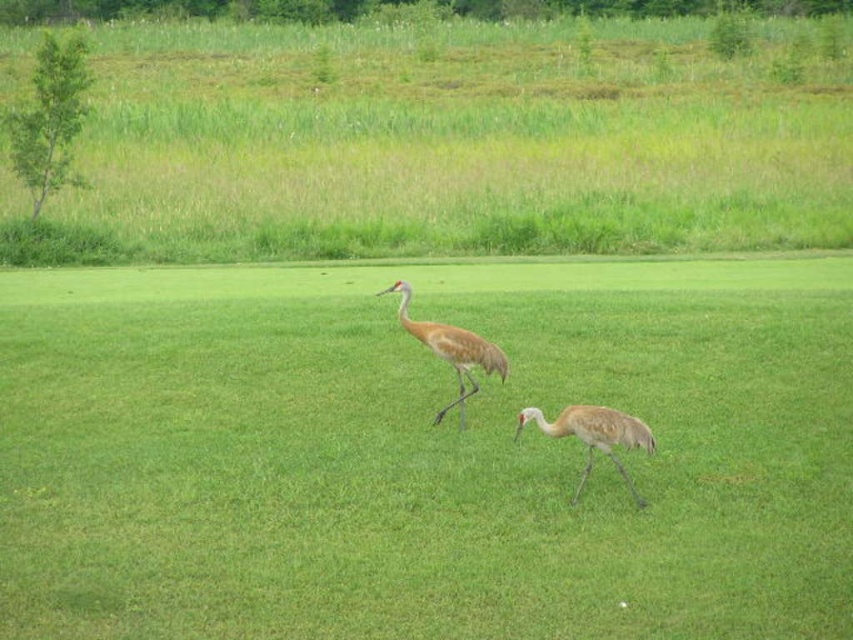
Question: Which point appears closest to the camera in this image?

Choices:
 (A) (425, 333)
 (B) (358, 317)
 (C) (605, 432)
 (D) (450, 84)

Answer: (C)

Question: Which is farther from the green grass at center?

Choices:
 (A) light brown feathered bird at center
 (B) brown feathered crane at center

Answer: (A)

Question: Estimate the real-world distances between objects in this image. Which object is closer to the light brown feathered bird at center?

Choices:
 (A) brown feathered crane at center
 (B) green grass at center
 (C) green grass at upper left

Answer: (A)

Question: Does green grass at center have a lesser width compared to light brown feathered bird at center?

Choices:
 (A) yes
 (B) no

Answer: (B)

Question: Where is green grass at upper left located in relation to brown feathered crane at center in the image?

Choices:
 (A) left
 (B) right

Answer: (A)

Question: From the image, what is the correct spatial relationship of green grass at center in relation to green grass at upper left?

Choices:
 (A) left
 (B) right

Answer: (B)